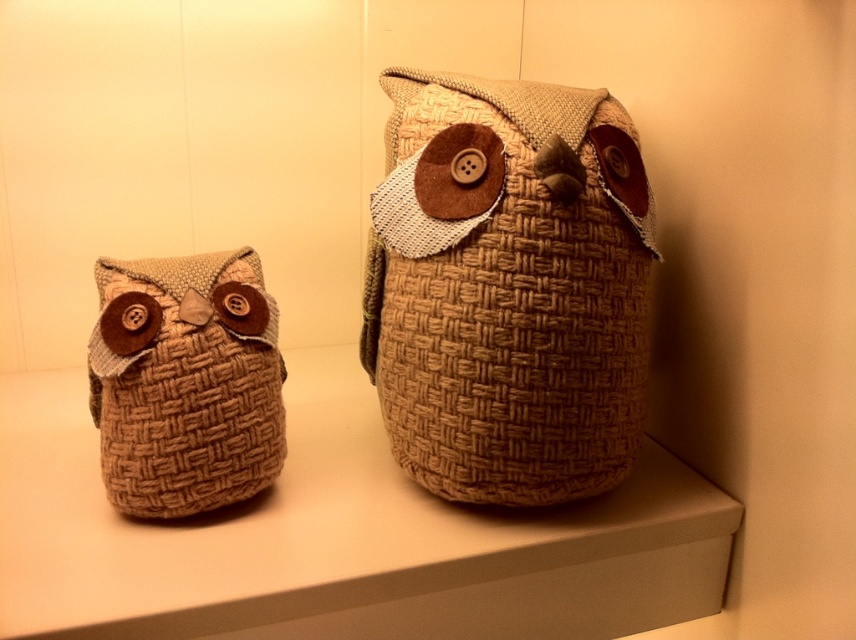
Which is behind, point (627, 310) or point (276, 394)?

Positioned behind is point (276, 394).

Can you confirm if woven fabric owl at center is smaller than woven fabric owl at left?

No, woven fabric owl at center is not smaller than woven fabric owl at left.

Between point (500, 307) and point (99, 374), which one is positioned behind?

The point (99, 374) is behind.

Find the location of a particular element. The width and height of the screenshot is (856, 640). woven fabric owl at center is located at coordinates (509, 288).

Does woven fabric shelf at center have a lesser height compared to woven fabric owl at center?

Yes.

Is woven fabric shelf at center to the right of woven fabric owl at center from the viewer's perspective?

Incorrect, woven fabric shelf at center is not on the right side of woven fabric owl at center.

Who is more forward, (163, 556) or (620, 236)?

Positioned in front is point (163, 556).

The width and height of the screenshot is (856, 640). What are the coordinates of `woven fabric shelf at center` in the screenshot? It's located at (337, 538).

Who is more forward, (70, 410) or (272, 362)?

Point (272, 362)

Which is more to the right, woven fabric shelf at center or woven fabric owl at left?

woven fabric shelf at center is more to the right.

Does point (592, 568) come in front of point (132, 403)?

No, (592, 568) is further to viewer.

This screenshot has height=640, width=856. In order to click on woven fabric shelf at center in this screenshot , I will do `click(337, 538)`.